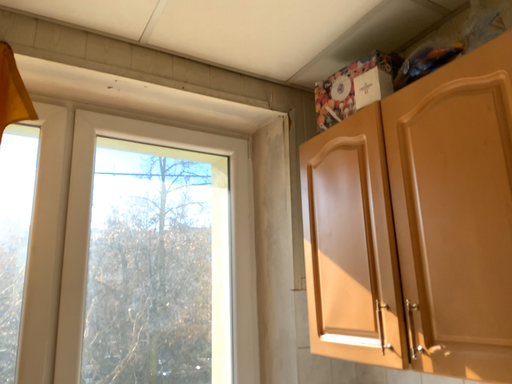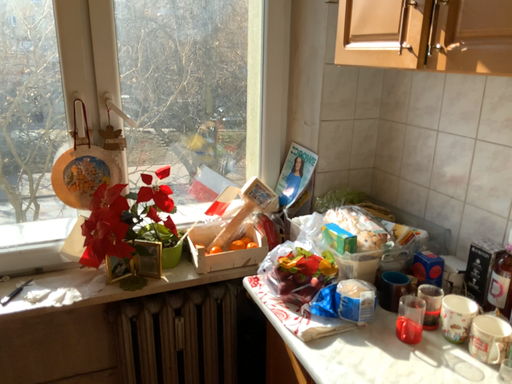
Question: How did the camera likely rotate when shooting the video?

Choices:
 (A) rotated left
 (B) rotated right

Answer: (A)